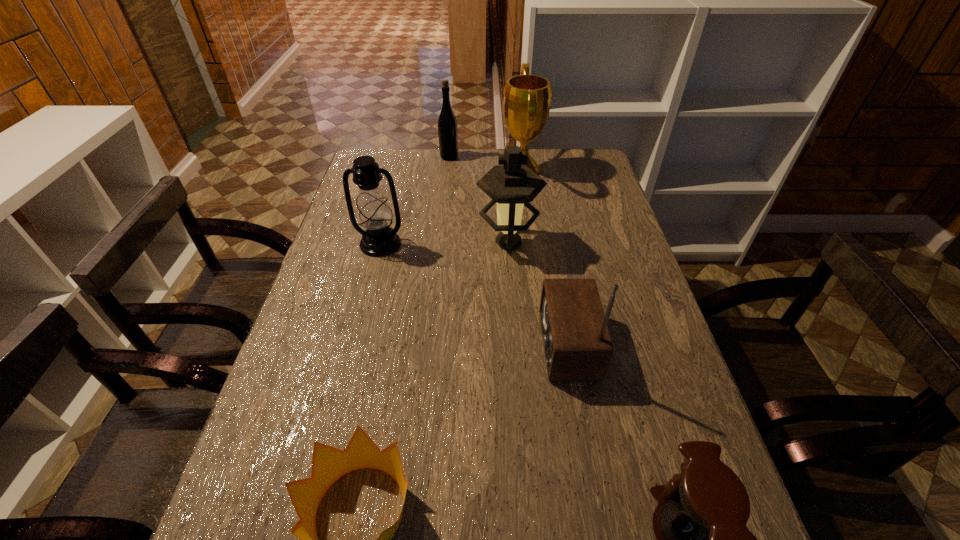
This screenshot has height=540, width=960. Find the location of `award`. award is located at coordinates (527, 98).

Find the location of a particular element. The image size is (960, 540). the right oil lamp is located at coordinates (512, 185).

Image resolution: width=960 pixels, height=540 pixels. Identify the location of beer bottle. (447, 124).

You are a GUI agent. You are given a task and a screenshot of the screen. Output one action in this format:
    pyautogui.click(x=<x>, y=<y>)
    Task: Click on the left oil lamp
    The image size is (960, 540).
    Given the screenshot: What is the action you would take?
    pyautogui.click(x=374, y=214)

Locate an element on the screen. Image resolution: width=960 pixels, height=540 pixels. radio receiver is located at coordinates (577, 344).

Where is `vacant space located on the front-facing side of the award`? vacant space located on the front-facing side of the award is located at coordinates (415, 170).

At what (x,y) coordinates should I click in order to perform the action: click on free space located on the front-facing side of the award. Please return your answer as a coordinate pair (x, y). Looking at the image, I should click on (437, 170).

Identify the location of vacant point located 0.360m on the front-facing side of the award. (404, 170).

Find the location of `free space located on the back of the right oil lamp`. free space located on the back of the right oil lamp is located at coordinates (503, 166).

Where is `free region located on the right of the beer bottle`? The width and height of the screenshot is (960, 540). free region located on the right of the beer bottle is located at coordinates (533, 157).